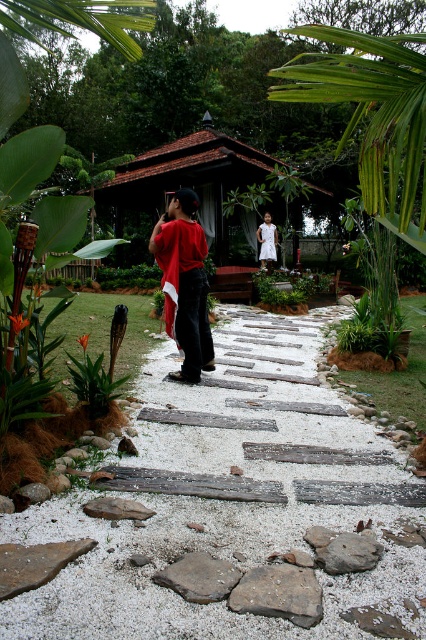
Which is in front, point (314, 296) or point (268, 252)?

Point (314, 296)

Which of these two, green leafy bush at center or white cotton dress at center, stands shorter?

green leafy bush at center

Which is in front, point (313, 275) or point (265, 227)?

Positioned in front is point (265, 227).

Locate an element on the screen. The image size is (426, 640). green leafy bush at center is located at coordinates (291, 285).

You are a GUI agent. You are given a task and a screenshot of the screen. Output one action in this format:
    pyautogui.click(x=<x>, y=<y>)
    Task: Click on the brown wooden gazebo at center
    
    Given the screenshot: What is the action you would take?
    pyautogui.click(x=187, y=179)

This screenshot has height=640, width=426. What do you see at coordinates (187, 179) in the screenshot?
I see `brown wooden gazebo at center` at bounding box center [187, 179].

Find the location of a particular element. This screenshot has width=426, height=640. brown wooden gazebo at center is located at coordinates (187, 179).

Does matte red shirt at center have a lesser width compared to white cotton dress at center?

No, matte red shirt at center is not thinner than white cotton dress at center.

Which is behind, point (163, 272) or point (264, 220)?

The point (264, 220) is more distant.

Is point (176, 252) behind point (265, 225)?

No, (176, 252) is closer to viewer.

Where is `matte red shirt at center`? matte red shirt at center is located at coordinates (184, 284).